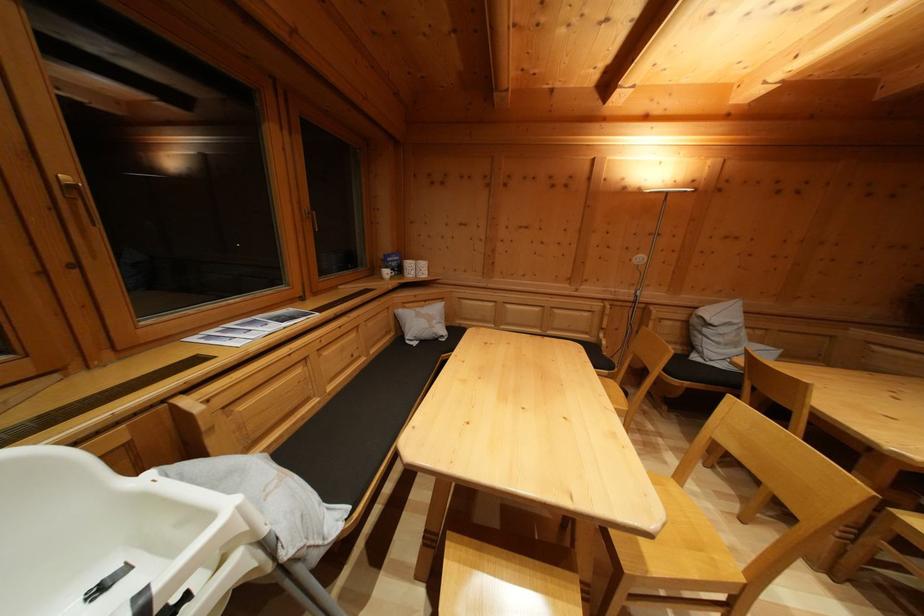
Image resolution: width=924 pixels, height=616 pixels. Describe the element at coordinates (78, 196) in the screenshot. I see `a golden window handle` at that location.